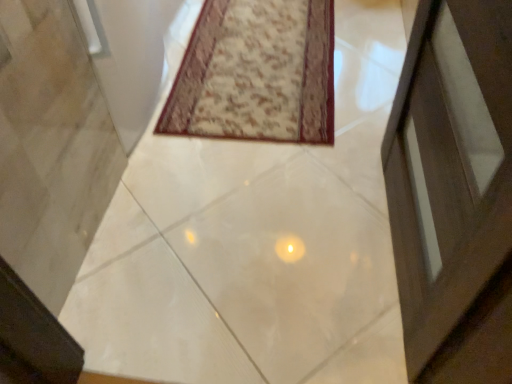
Where is `beige textured rug at center`? beige textured rug at center is located at coordinates (256, 73).

Describe the element at coordinates (256, 73) in the screenshot. The height and width of the screenshot is (384, 512). I see `beige textured rug at center` at that location.

Measure the distance between white glossy concrete at center and camera.

white glossy concrete at center and camera are 3.35 feet apart from each other.

Identify the location of white glossy concrete at center. (254, 241).

What do you see at coordinates (254, 241) in the screenshot? The width and height of the screenshot is (512, 384). I see `white glossy concrete at center` at bounding box center [254, 241].

You are a GUI agent. You are given a task and a screenshot of the screen. Output one action in this format:
    pyautogui.click(x=<x>, y=<y>)
    Task: Click on the beige textured rug at center
    Image resolution: width=512 pixels, height=384 pixels.
    Given the screenshot: What is the action you would take?
    pyautogui.click(x=256, y=73)

Is beige textured rug at center to the right of white glossy concrete at center from the viewer's perspective?

No.

Which object is closer to the camera, beige textured rug at center or white glossy concrete at center?

white glossy concrete at center is in front.

Considering the points (321, 118) and (118, 198), which point is behind, point (321, 118) or point (118, 198)?

The point (321, 118) is farther.

From the image's perspective, which is above, beige textured rug at center or white glossy concrete at center?

beige textured rug at center, from the image's perspective.

From a real-world perspective, between beige textured rug at center and white glossy concrete at center, who is vertically lower?

white glossy concrete at center is physically lower.

Is beige textured rug at center thinner than white glossy concrete at center?

Correct, the width of beige textured rug at center is less than that of white glossy concrete at center.

Can you confirm if beige textured rug at center is shorter than white glossy concrete at center?

Correct, beige textured rug at center is not as tall as white glossy concrete at center.

Considering the sizes of objects beige textured rug at center and white glossy concrete at center in the image provided, who is smaller, beige textured rug at center or white glossy concrete at center?

Smaller between the two is beige textured rug at center.

Is beige textured rug at center outside of white glossy concrete at center?

No, beige textured rug at center is inside or overlapping with white glossy concrete at center.

Is the surface of beige textured rug at center in direct contact with white glossy concrete at center?

No, beige textured rug at center is not next to white glossy concrete at center.

Could you tell me if beige textured rug at center is facing white glossy concrete at center?

Yes, beige textured rug at center is facing white glossy concrete at center.

What's the angular difference between beige textured rug at center and white glossy concrete at center's facing directions?

The angle between the facing direction of beige textured rug at center and the facing direction of white glossy concrete at center is 1.89 degrees.

You are a GUI agent. You are given a task and a screenshot of the screen. Output one action in this format:
    pyautogui.click(x=<x>, y=<y>)
    Task: Click on the concrete that appears in front of the beige textured rug at center
    Image resolution: width=512 pixels, height=384 pixels.
    Given the screenshot: What is the action you would take?
    pyautogui.click(x=254, y=241)

Which object is positioned more to the right, white glossy concrete at center or beige textured rug at center?

Positioned to the right is white glossy concrete at center.

Which is behind, white glossy concrete at center or beige textured rug at center?

beige textured rug at center is further away from the camera.

Is point (213, 312) closer to viewer compared to point (222, 55)?

Yes, it is in front of point (222, 55).

From the image's perspective, who appears lower, white glossy concrete at center or beige textured rug at center?

white glossy concrete at center appears lower in the image.

From a real-world perspective, is white glossy concrete at center located beneath beige textured rug at center?

Correct, in the physical world, white glossy concrete at center is lower than beige textured rug at center.

Can you confirm if white glossy concrete at center is wider than beige textured rug at center?

Indeed, white glossy concrete at center has a greater width compared to beige textured rug at center.

Is white glossy concrete at center shorter than beige textured rug at center?

No.

Between white glossy concrete at center and beige textured rug at center, which one has larger size?

Bigger between the two is white glossy concrete at center.

In the scene shown: Is white glossy concrete at center not within beige textured rug at center?

Yes, white glossy concrete at center is not within beige textured rug at center.

Are white glossy concrete at center and beige textured rug at center located far from each other?

They are positioned close to each other.

Is white glossy concrete at center oriented away from beige textured rug at center?

No.

What's the angular difference between white glossy concrete at center and beige textured rug at center's facing directions?

The angle between the facing direction of white glossy concrete at center and the facing direction of beige textured rug at center is 1.89 degrees.

Where is `concrete in front of the beige textured rug at center`? Image resolution: width=512 pixels, height=384 pixels. concrete in front of the beige textured rug at center is located at coordinates click(x=254, y=241).

At what (x,y) coordinates should I click in order to perform the action: click on mat lying behind the white glossy concrete at center. Please return your answer as a coordinate pair (x, y). Looking at the image, I should click on (256, 73).

I want to click on concrete in front of the beige textured rug at center, so click(x=254, y=241).